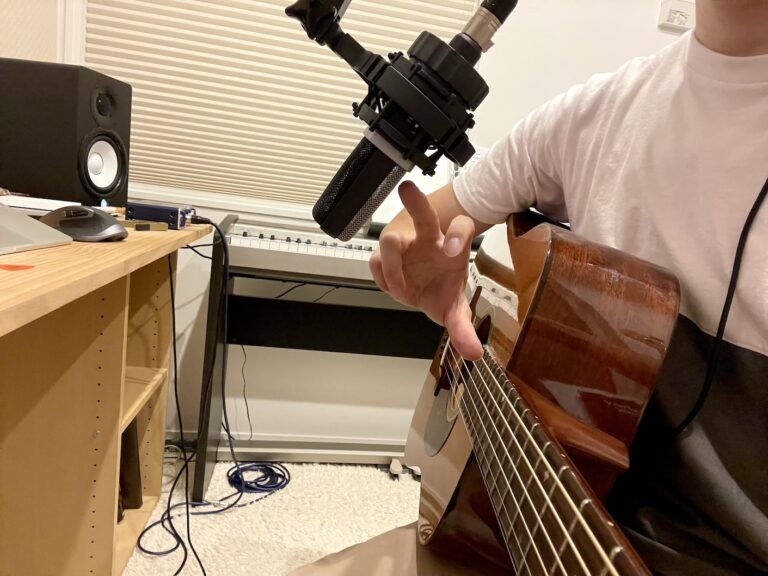
Locate an element on the screen. shaggy carpet is located at coordinates (313, 522).